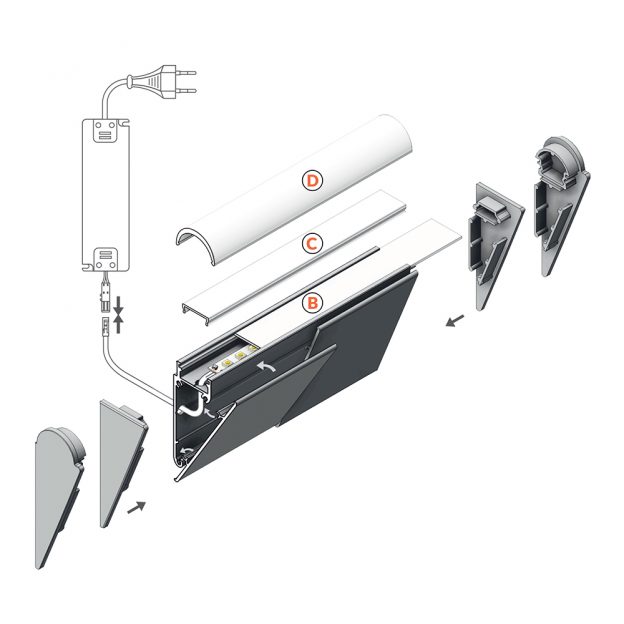
Locate an element on the screen. The height and width of the screenshot is (624, 624). gray looking thick metallic folder is located at coordinates (354, 349), (261, 404), (230, 384).